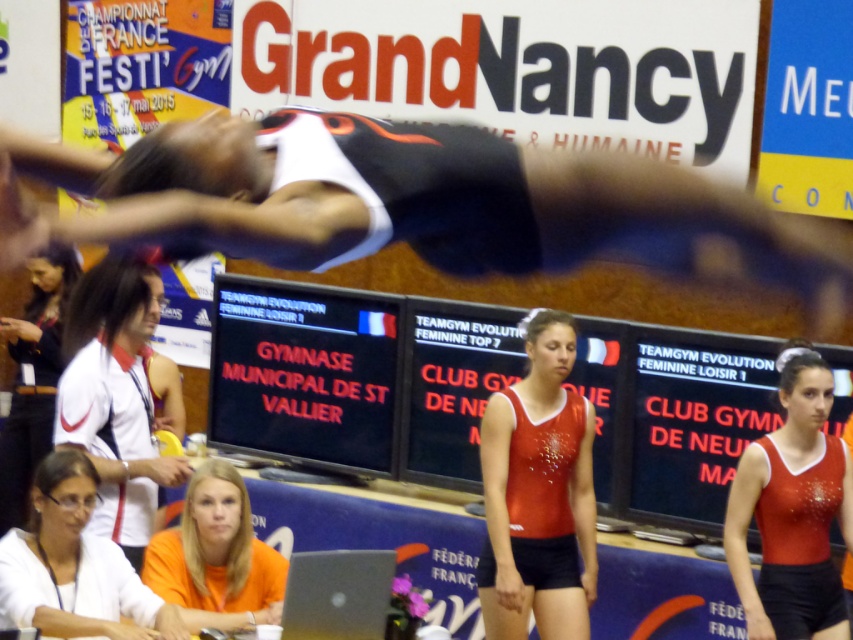
Question: Is white fabric shirt at left wider than silver metallic laptop at lower center?

Choices:
 (A) no
 (B) yes

Answer: (B)

Question: Does red sparkly leotard at center have a smaller size compared to orange fabric shirt at lower center?

Choices:
 (A) yes
 (B) no

Answer: (B)

Question: Among these points, which one is farthest from the camera?

Choices:
 (A) (329, 609)
 (B) (537, 538)
 (C) (47, 506)

Answer: (B)

Question: Which point appears closest to the camera in this image?

Choices:
 (A) (48, 259)
 (B) (822, 477)
 (C) (241, 253)

Answer: (C)

Question: Does black matte leotard at upper center appear on the right side of orange fabric shirt at lower center?

Choices:
 (A) yes
 (B) no

Answer: (A)

Question: Which point is closer to the camera?

Choices:
 (A) (364, 227)
 (B) (531, 481)
 (C) (238, 513)
 (D) (366, 604)

Answer: (A)